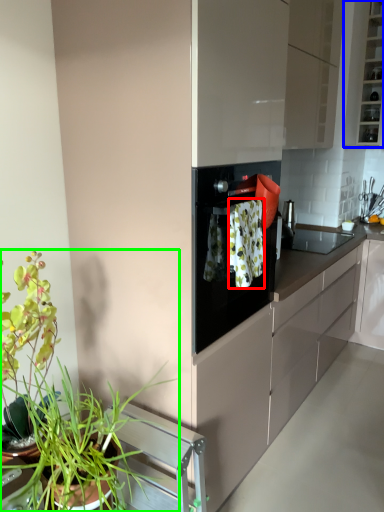
Question: Which object is the closest to the laundry (highlighted by a red box)? Choose among these: cabinetry (highlighted by a blue box) or houseplant (highlighted by a green box).

Choices:
 (A) cabinetry
 (B) houseplant

Answer: (B)